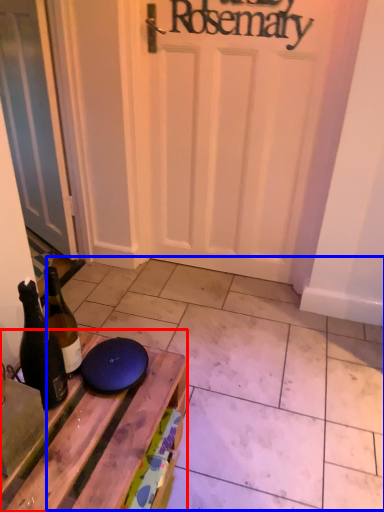
Question: Which object is closer to the camera taking this photo, table (highlighted by a red box) or tile (highlighted by a blue box)?

Choices:
 (A) table
 (B) tile

Answer: (A)